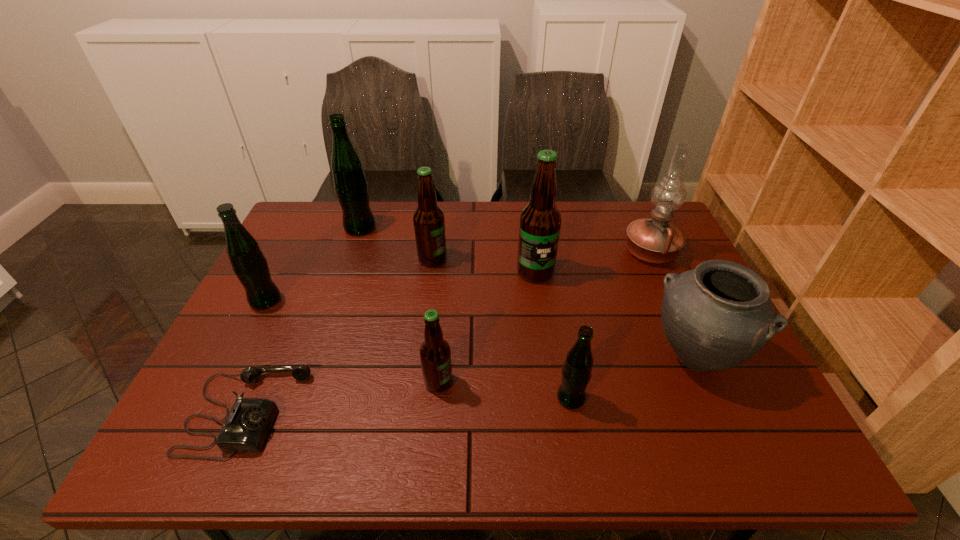
Where is `free space at the far edge of the desktop`? Image resolution: width=960 pixels, height=540 pixels. free space at the far edge of the desktop is located at coordinates (568, 233).

Where is `free space at the near edge`? free space at the near edge is located at coordinates 557,458.

Where is `free region at the left edge of the desktop`? The height and width of the screenshot is (540, 960). free region at the left edge of the desktop is located at coordinates click(x=223, y=348).

Where is `vacant space at the right edge of the desktop`? vacant space at the right edge of the desktop is located at coordinates (691, 374).

Locate an element on the screen. The width and height of the screenshot is (960, 540). free space at the far left corner is located at coordinates (314, 209).

In the image, there is a desktop. Where is `vacant space at the near left corner`? vacant space at the near left corner is located at coordinates (201, 452).

This screenshot has height=540, width=960. I want to click on vacant space at the far right corner of the desktop, so click(645, 207).

I want to click on free area in between the rightmost green beer bottle and the oil lamp, so click(x=611, y=325).

Identify the location of vacant point located between the leftmost beer bottle and the second biggest brown beer bottle. This screenshot has height=540, width=960. (349, 280).

Locate an element on the screen. This screenshot has height=540, width=960. vacant point located between the second smallest brown beer bottle and the biggest brown beer bottle is located at coordinates tap(484, 265).